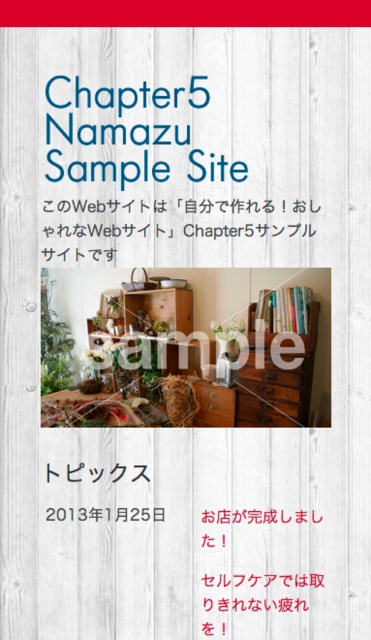
Question: Does wooden chest of drawers at center-right have a smaller size compared to hardcover books at upper center?

Choices:
 (A) no
 (B) yes

Answer: (A)

Question: Which of the following is the farthest from the observer?

Choices:
 (A) hardcover books at upper center
 (B) wooden bookshelf at center
 (C) wooden chest of drawers at center-right

Answer: (B)

Question: Among these objects, which one is farthest from the camera?

Choices:
 (A) wooden bookshelf at center
 (B) wooden chest of drawers at center-right
 (C) hardcover books at upper center

Answer: (A)

Question: Is wooden chest of drawers at center-right bigger than wooden bookshelf at center?

Choices:
 (A) no
 (B) yes

Answer: (A)

Question: Does wooden chest of drawers at center-right appear on the right side of hardcover books at upper center?

Choices:
 (A) no
 (B) yes

Answer: (A)

Question: Which is farther from the wooden bookshelf at center?

Choices:
 (A) wooden chest of drawers at center-right
 (B) hardcover books at upper center

Answer: (A)